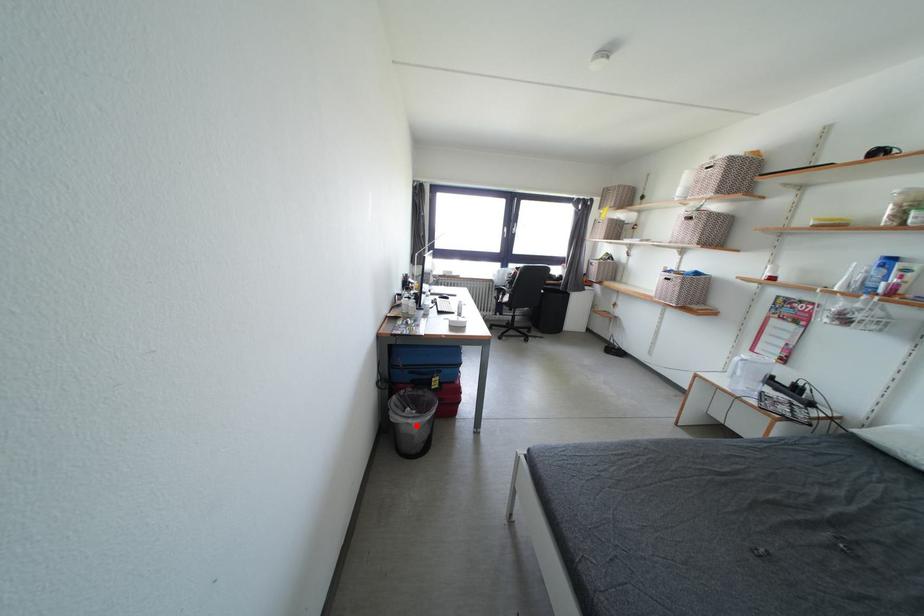
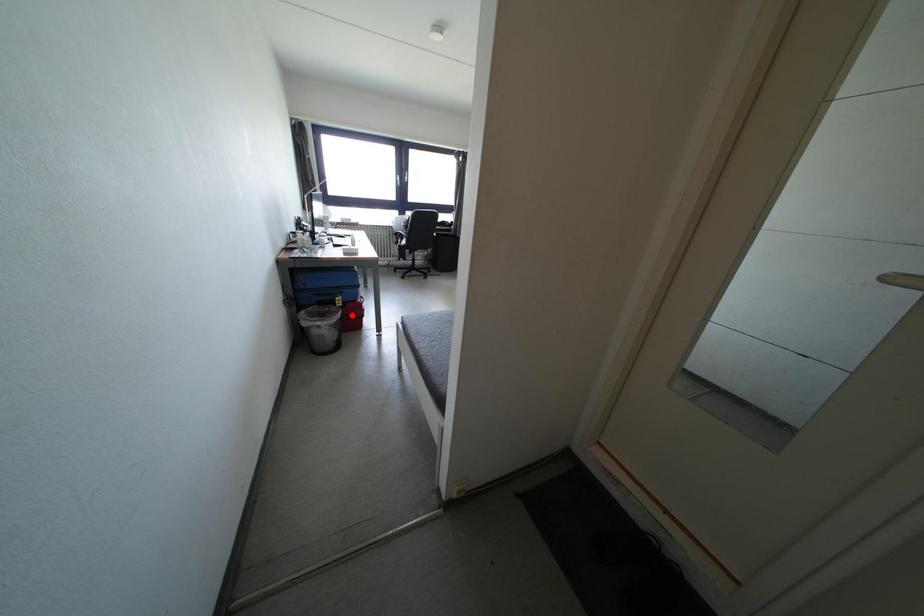
I am providing you with two images of the same scene from different viewpoints. A red point is marked on the first image and another point is marked on the second image. Does the point marked in image1 correspond to the same location as the one in image2?

No